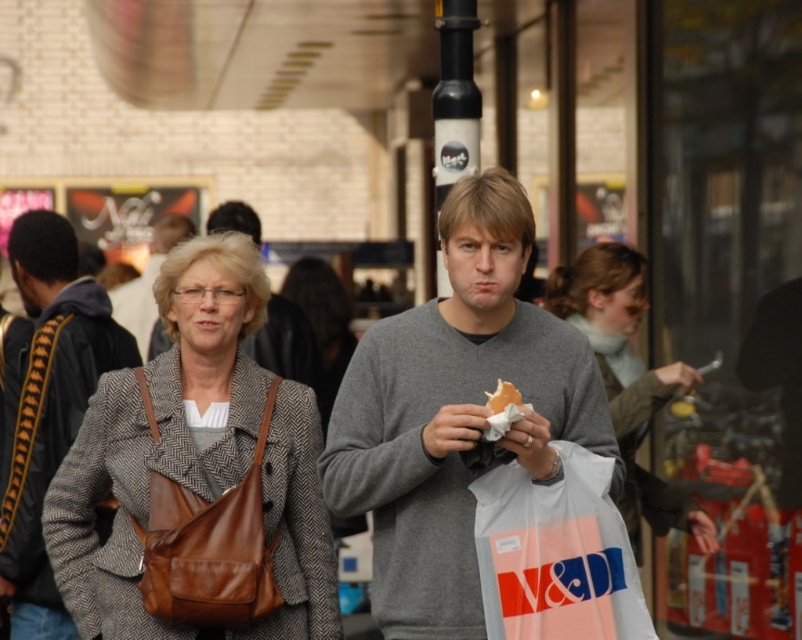
Does gray wool coat at center appear under brown leather bag at center-left?

Actually, gray wool coat at center is above brown leather bag at center-left.

Does gray wool coat at center have a lesser width compared to brown leather bag at center-left?

No.

Is point (71, 282) behind point (185, 524)?

Yes, point (71, 282) is behind point (185, 524).

This screenshot has height=640, width=802. What are the coordinates of `gray wool coat at center` in the screenshot? It's located at (49, 404).

Is gray sweater at center below white paper sandwich at center?

No.

Does point (148, 339) come in front of point (505, 401)?

No.

Who is more forward, [136,333] or [517,410]?

Point [517,410] is more forward.

This screenshot has width=802, height=640. I want to click on gray sweater at center, so [x=148, y=282].

This screenshot has width=802, height=640. What do you see at coordinates (456, 412) in the screenshot? I see `gray fabric sweater at center` at bounding box center [456, 412].

Does gray fabric sweater at center have a smaller size compared to gray wool coat at center?

Yes.

Which is behind, point (452, 627) or point (18, 452)?

Positioned behind is point (18, 452).

Locate an element on the screen. This screenshot has height=640, width=802. gray fabric sweater at center is located at coordinates (456, 412).